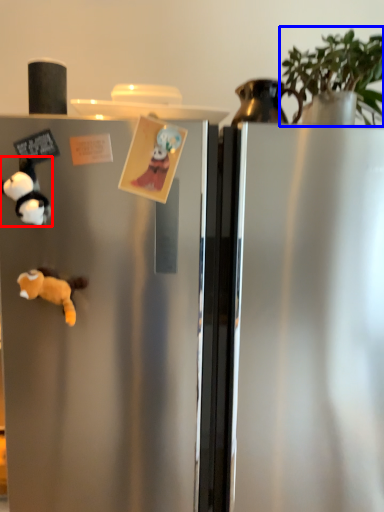
Question: Among these objects, which one is nearest to the camera, toy (highlighted by a red box) or plant (highlighted by a blue box)?

Choices:
 (A) toy
 (B) plant

Answer: (A)